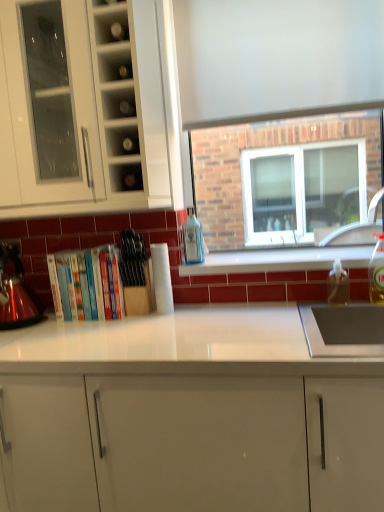
Where is `vacant space in front of hardcover books at center`? vacant space in front of hardcover books at center is located at coordinates (80, 329).